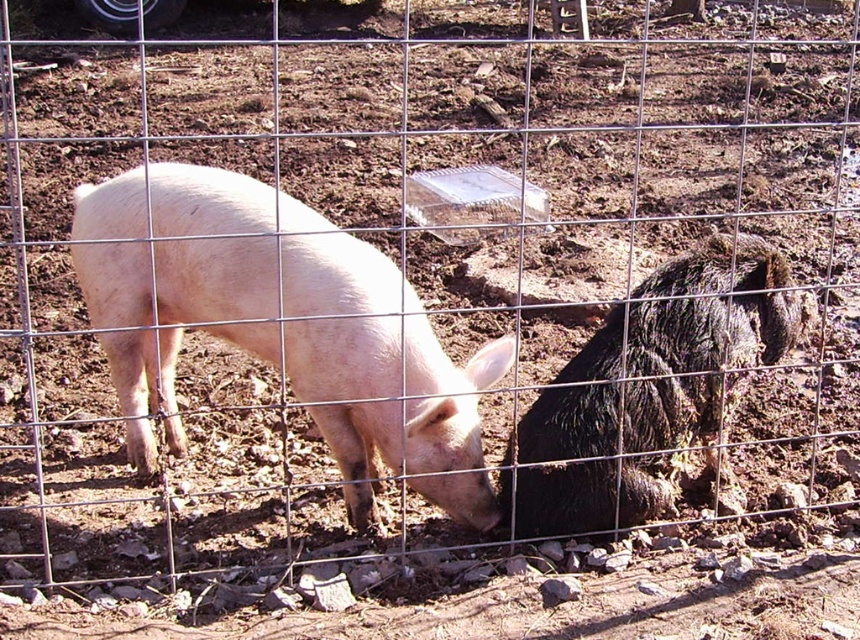
Question: Where is matte pink pig at center located in relation to shaggy black pig at right in the image?

Choices:
 (A) right
 (B) left

Answer: (B)

Question: Which point is closer to the camera?

Choices:
 (A) shaggy black pig at right
 (B) matte pink pig at center

Answer: (B)

Question: Is matte pink pig at center positioned in front of shaggy black pig at right?

Choices:
 (A) yes
 (B) no

Answer: (A)

Question: Which point is farther to the camera?

Choices:
 (A) shaggy black pig at right
 (B) matte pink pig at center

Answer: (A)

Question: Can you confirm if matte pink pig at center is positioned to the left of shaggy black pig at right?

Choices:
 (A) no
 (B) yes

Answer: (B)

Question: Among these points, which one is nearest to the camera?

Choices:
 (A) (647, 470)
 (B) (120, 369)

Answer: (A)